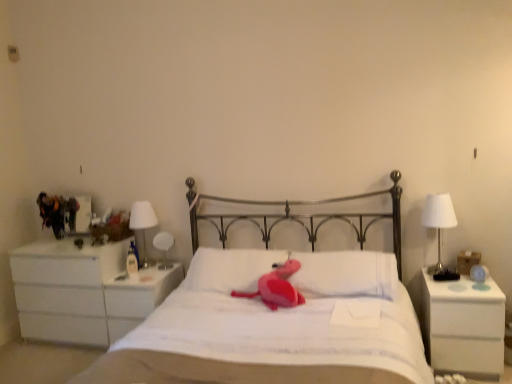
The height and width of the screenshot is (384, 512). What do you see at coordinates (276, 287) in the screenshot?
I see `matte pink plush at center` at bounding box center [276, 287].

Describe the element at coordinates (439, 229) in the screenshot. I see `white glossy table lamp at right, the first bedside lamp from the front` at that location.

What is the approximate height of white glossy bedside lamp at left, the 1th bedside lamp viewed from the left?

white glossy bedside lamp at left, the 1th bedside lamp viewed from the left, is 20.90 inches tall.

Image resolution: width=512 pixels, height=384 pixels. What do you see at coordinates (137, 298) in the screenshot?
I see `white plastic nightstand at left, the 1th nightstand positioned from the left` at bounding box center [137, 298].

What do you see at coordinates (346, 274) in the screenshot? I see `white soft pillow at center, which is the 2th pillow in left-to-right order` at bounding box center [346, 274].

Find the location of `white soft pillow at center, positioned as the 1th pillow in left-to-right order`. white soft pillow at center, positioned as the 1th pillow in left-to-right order is located at coordinates (230, 269).

This screenshot has width=512, height=384. In order to click on matte pink plush at center in this screenshot , I will do `click(276, 287)`.

Is white matte chest of drawers at left surrounding white glossy bedside lamp at left, the 1th bedside lamp viewed from the left?

No, white matte chest of drawers at left does not contain white glossy bedside lamp at left, the 1th bedside lamp viewed from the left.

Where is `bedside lamp behind the white matte chest of drawers at left`? Image resolution: width=512 pixels, height=384 pixels. bedside lamp behind the white matte chest of drawers at left is located at coordinates (143, 222).

Considering the sizes of objects white matte chest of drawers at left and white glossy bedside lamp at left, the 1th bedside lamp viewed from the left, in the image provided, who is bigger, white matte chest of drawers at left or white glossy bedside lamp at left, the 1th bedside lamp viewed from the left,?

white matte chest of drawers at left.

Is white matte nightstand at right, which is the second nightstand in back-to-front order, not within white glossy table lamp at right, the first bedside lamp when ordered from right to left?

Yes, white matte nightstand at right, which is the second nightstand in back-to-front order, is located beyond the bounds of white glossy table lamp at right, the first bedside lamp when ordered from right to left.

Is white matte nightstand at right, marked as the 1th nightstand in a right-to-left arrangement, facing away from white glossy table lamp at right, positioned as the 2th bedside lamp in left-to-right order?

No, white matte nightstand at right, marked as the 1th nightstand in a right-to-left arrangement, is not facing away from white glossy table lamp at right, positioned as the 2th bedside lamp in left-to-right order.

Is white matte nightstand at right, the first nightstand when ordered from front to back, taller than white glossy table lamp at right, the first bedside lamp from the front?

Yes.

Which is less distant, [481,363] or [425,216]?

Point [481,363] appears to be closer to the viewer than point [425,216].

From the image's perspective, is matte pink plush at center on white glossy bedside lamp at left, which is the second bedside lamp from front to back?

No, from the image's perspective, matte pink plush at center is not on top of white glossy bedside lamp at left, which is the second bedside lamp from front to back.

Which is closer to the camera, [297,292] or [141,222]?

Point [297,292] is positioned closer to the camera compared to point [141,222].

Can you tell me how much matte pink plush at center and white glossy bedside lamp at left, the 1th bedside lamp viewed from the left, differ in facing direction?

The angular difference between matte pink plush at center and white glossy bedside lamp at left, the 1th bedside lamp viewed from the left, is 9.26 degrees.

Where is `animal lying below the white glossy bedside lamp at left, which is the second bedside lamp from front to back (from the image's perspective)`? The width and height of the screenshot is (512, 384). animal lying below the white glossy bedside lamp at left, which is the second bedside lamp from front to back (from the image's perspective) is located at coordinates (276, 287).

From a real-world perspective, who is located lower, white soft pillow at center, positioned as the 1th pillow in left-to-right order, or matte pink plush at center?

matte pink plush at center is physically lower.

Can you tell me how much white soft pillow at center, placed as the 2th pillow when sorted from right to left, and matte pink plush at center differ in facing direction?

There is a 5.58-degree angle between the facing directions of white soft pillow at center, placed as the 2th pillow when sorted from right to left, and matte pink plush at center.

Do you think white soft pillow at center, positioned as the 1th pillow in left-to-right order, is within matte pink plush at center, or outside of it?

white soft pillow at center, positioned as the 1th pillow in left-to-right order, is located beyond the bounds of matte pink plush at center.

Between white matte nightstand at right, which appears as the second nightstand when viewed from the left, and white plastic nightstand at left, the 1th nightstand positioned from the left, which one has smaller width?

With smaller width is white plastic nightstand at left, the 1th nightstand positioned from the left.

From the image's perspective, is white matte nightstand at right, the first nightstand when ordered from front to back, below white plastic nightstand at left, the 2th nightstand when ordered from front to back?

Actually, white matte nightstand at right, the first nightstand when ordered from front to back, appears above white plastic nightstand at left, the 2th nightstand when ordered from front to back, in the image.

Is there a large distance between white matte nightstand at right, which appears as the second nightstand when viewed from the left, and white plastic nightstand at left, the 1th nightstand positioned from the left?

Yes, white matte nightstand at right, which appears as the second nightstand when viewed from the left, and white plastic nightstand at left, the 1th nightstand positioned from the left, are located far from each other.

Image resolution: width=512 pixels, height=384 pixels. Identify the location of nightstand that appears above the white plastic nightstand at left, the 1th nightstand positioned from the left (from the image's perspective). [x=463, y=327].

Considering the points (82, 315) and (297, 274), which point is behind, point (82, 315) or point (297, 274)?

The point (82, 315) is behind.

How distant is white matte chest of drawers at left from white soft pillow at center, which is the first pillow in right-to-left order?

1.45 meters.

From a real-world perspective, is white matte chest of drawers at left located higher than white soft pillow at center, which is the 2th pillow in left-to-right order?

Incorrect, from a real-world perspective, white matte chest of drawers at left is lower than white soft pillow at center, which is the 2th pillow in left-to-right order.

From the image's perspective, is white matte chest of drawers at left under white soft pillow at center, which is the first pillow in right-to-left order?

Yes, from the image's perspective, white matte chest of drawers at left is below white soft pillow at center, which is the first pillow in right-to-left order.

Is white glossy table lamp at left wider than white glossy table lamp at right, positioned as the 2th bedside lamp in back-to-front order?

No.

Is white glossy table lamp at left positioned before white glossy table lamp at right, positioned as the 2th bedside lamp in left-to-right order?

No, white glossy table lamp at left is further to the viewer.

In the image, there is a white glossy table lamp at right, positioned as the 2th bedside lamp in left-to-right order. At what (x,y) coordinates should I click in order to perform the action: click on table lamp below it (from the image's perspective). Please return your answer as a coordinate pair (x, y). Image resolution: width=512 pixels, height=384 pixels. Looking at the image, I should click on (164, 247).

Identify the location of the chest of drawers located below the white glossy bedside lamp at left, the 1th bedside lamp in the back-to-front sequence (from the image's perspective). (83, 291).

The height and width of the screenshot is (384, 512). In order to click on nightstand on the right side of white glossy table lamp at right, positioned as the 2th bedside lamp in back-to-front order in this screenshot , I will do `click(463, 327)`.

Which object lies nearer to the anchor point white matte bed at center, matte pink plush at center or white glossy bedside lamp at left, the 2th bedside lamp when ordered from right to left?

matte pink plush at center is closer to white matte bed at center.

Which object lies further to the anchor point white glossy table lamp at left, white soft pillow at center, positioned as the 1th pillow in left-to-right order, or white glossy table lamp at right, positioned as the 2th bedside lamp in left-to-right order?

white glossy table lamp at right, positioned as the 2th bedside lamp in left-to-right order, is further to white glossy table lamp at left.

From the image, which object appears to be nearer to white glossy table lamp at left, white soft pillow at center, which is the 2th pillow in left-to-right order, or matte pink plush at center?

matte pink plush at center.

Estimate the real-world distances between objects in this image. Which object is closer to white glossy table lamp at left, matte pink plush at center or white soft pillow at center, positioned as the 1th pillow in left-to-right order?

white soft pillow at center, positioned as the 1th pillow in left-to-right order, is closer to white glossy table lamp at left.

From the image, which object appears to be farther from white glossy bedside lamp at left, the 2th bedside lamp when ordered from right to left, white matte bed at center or white matte nightstand at right, the first nightstand when ordered from front to back?

The object further to white glossy bedside lamp at left, the 2th bedside lamp when ordered from right to left, is white matte nightstand at right, the first nightstand when ordered from front to back.

Based on their spatial positions, is white matte bed at center or white soft pillow at center, which is the first pillow in right-to-left order, further from white soft pillow at center, positioned as the 1th pillow in left-to-right order?

white soft pillow at center, which is the first pillow in right-to-left order, is further to white soft pillow at center, positioned as the 1th pillow in left-to-right order.

Looking at the image, which one is located further to white glossy bedside lamp at left, the 1th bedside lamp in the back-to-front sequence, white glossy table lamp at left or white soft pillow at center, positioned as the 1th pillow in left-to-right order?

Based on the image, white soft pillow at center, positioned as the 1th pillow in left-to-right order, appears to be further to white glossy bedside lamp at left, the 1th bedside lamp in the back-to-front sequence.

Estimate the real-world distances between objects in this image. Which object is closer to white plastic nightstand at left, the 2th nightstand from the right, matte pink plush at center or white matte chest of drawers at left?

white matte chest of drawers at left.

Find the location of `pillow between white plastic nightstand at left, the 1th nightstand positioned from the left, and white soft pillow at center, which is the first pillow in right-to-left order`. pillow between white plastic nightstand at left, the 1th nightstand positioned from the left, and white soft pillow at center, which is the first pillow in right-to-left order is located at coordinates (230, 269).

The image size is (512, 384). I want to click on bedside lamp between white matte chest of drawers at left and white glossy table lamp at right, positioned as the 2th bedside lamp in back-to-front order, from left to right, so click(x=143, y=222).

What are the coordinates of `animal between white matte bed at center and white glossy table lamp at left from front to back` in the screenshot? It's located at (276, 287).

Locate an element on the screen. animal located between white matte chest of drawers at left and white glossy table lamp at right, positioned as the 2th bedside lamp in back-to-front order, in the left-right direction is located at coordinates (276, 287).